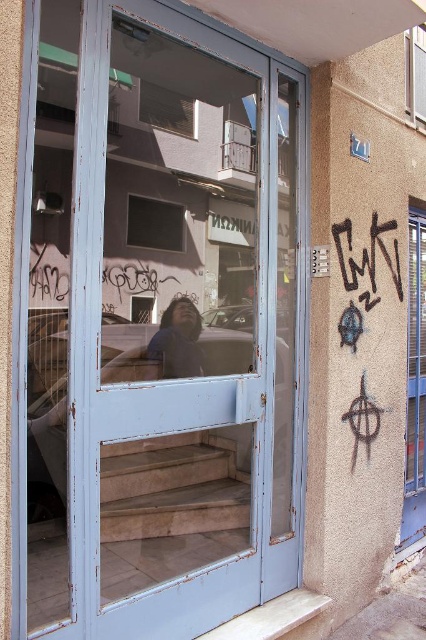
You are a delivery person trying to see through the clear glass window at upper center and the clear glass window at upper right to check if the office is open. Based on their positions, which window is lower and might give you a better view of the entrance?

The clear glass window at upper center is below the clear glass window at upper right, so it is lower and might provide a better view of the entrance.

You are standing in front of the weathered blue double door with glass panels and want to reach the graffiti on the wall to the right of the door. The point you are standing at is at coordinate point (155, 241). If you walk straight towards the graffiti, will you have to move forward more than 2 meters?

The distance between the point (155, 241) and the graffiti on the wall to the right of the door is 2.36 meters. Therefore, you will have to move forward more than 2 meters to reach the graffiti.

Consider the image. You are a delivery person with a 1.8 meter wide package. You need to move it through the space between the matte glass window at center and the clear glass window at upper right. Can the package fit through the space between them?

The space between the matte glass window at center and the clear glass window at upper right is 1.91 meters. Since the package is 1.8 meters wide, it can fit through the space as the width of the space is greater than the package.